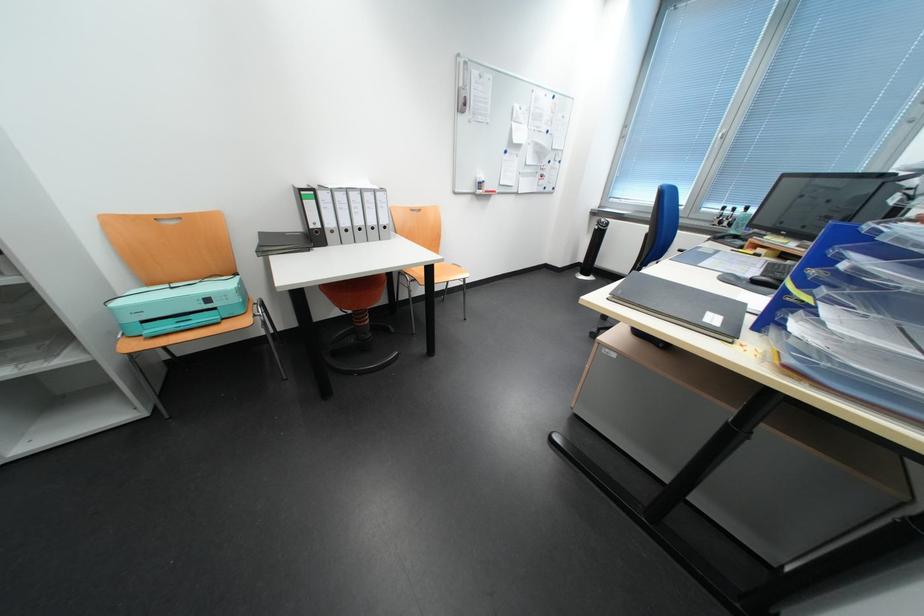
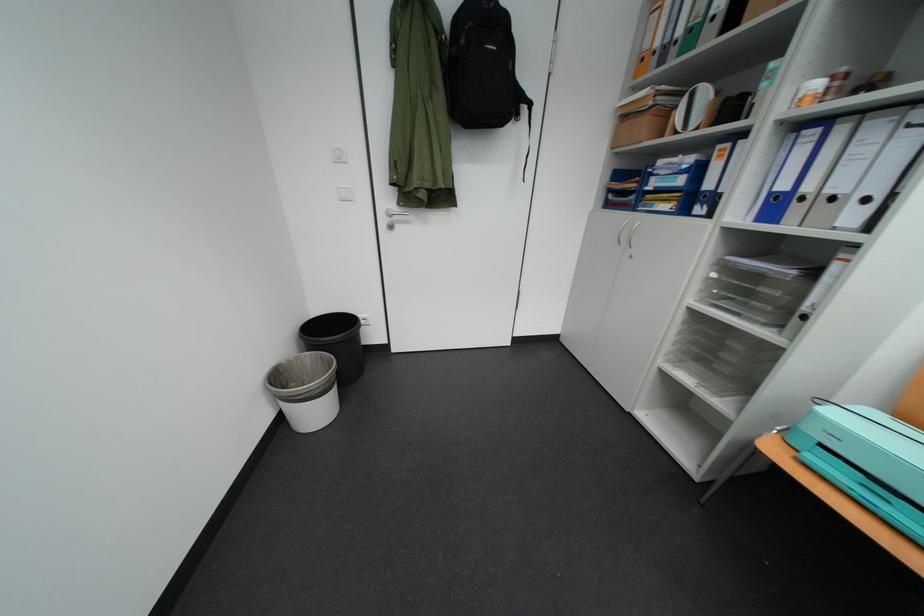
Find the pixel in the second image that matches point (154, 323) in the first image.

(833, 447)